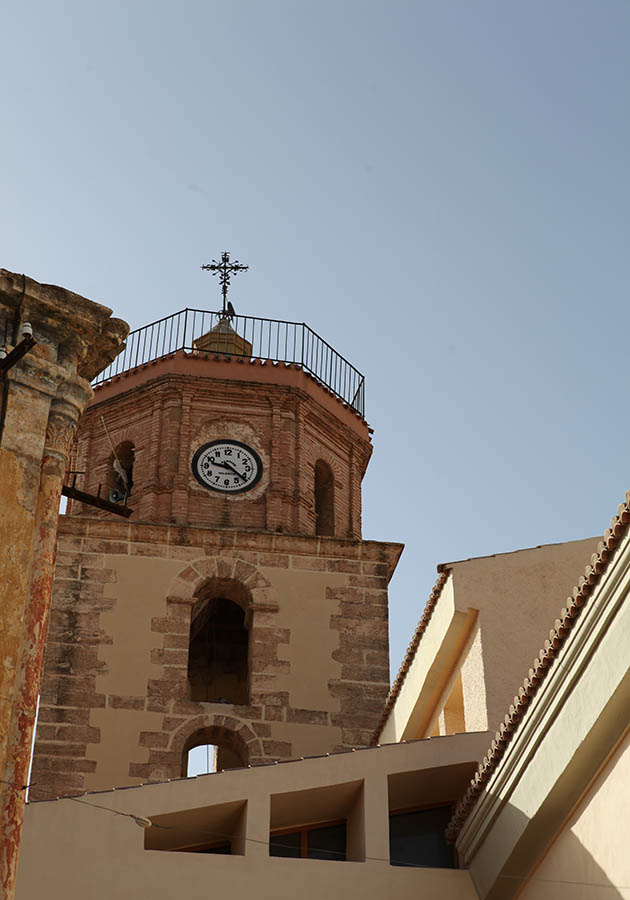
You are a GUI agent. You are given a task and a screenshot of the screen. Output one action in this format:
    pyautogui.click(x=<x>, y=<y>)
    Task: Click on the clock
    
    Given the screenshot: What is the action you would take?
    pyautogui.click(x=220, y=478)